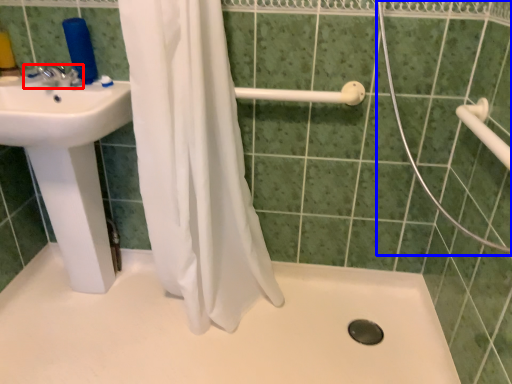
Question: Which point is closer to the camera, tap (highlighted by a red box) or shower door (highlighted by a blue box)?

Choices:
 (A) tap
 (B) shower door

Answer: (B)